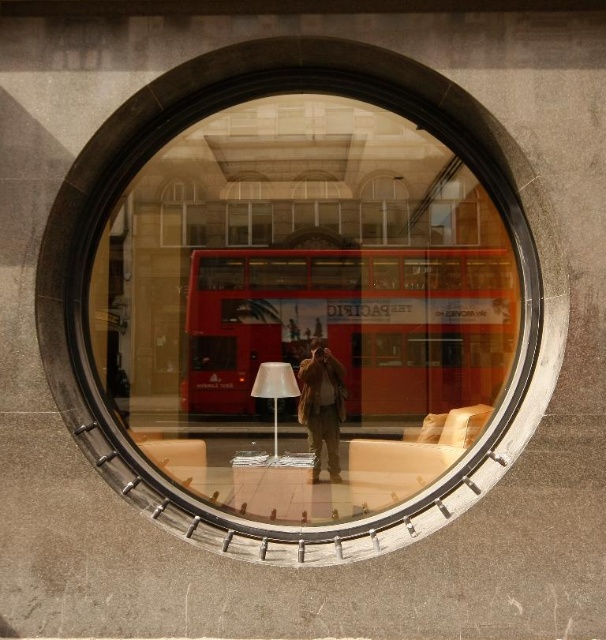
In the scene shown: You are standing in front of the circular window and want to pick up the brown leather jacket at center and the white matte lamp at center. Which object should you reach for first based on their positions?

You should reach for the brown leather jacket at center first because it is closer to you than the white matte lamp at center.

You are a delivery drone with a wingspan of 3 feet. You need to fly through the transparent glass window at center to deliver a package to the white matte lamp at center. Can you safely navigate the space between them?

The distance between the transparent glass window at center and the white matte lamp at center is 11.46 feet. Since your drone has a wingspan of 3 feet, there is sufficient space for it to navigate safely between them.

You are standing in front of the circular window and notice a white matte lamp at center and a transparent glass window at center. Which object is positioned to the right of the other?

The transparent glass window at center is to the right of white matte lamp at center according to the description.